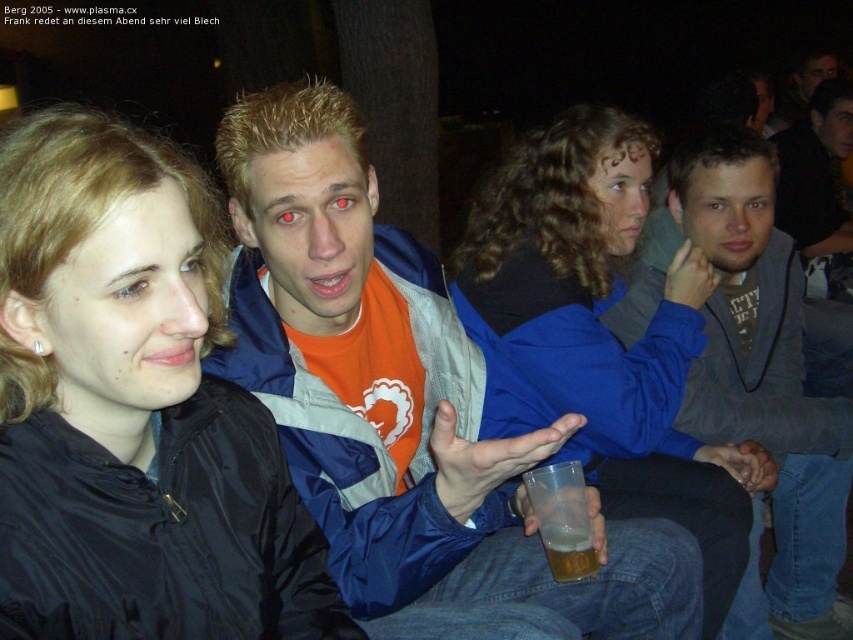
Question: Which object appears farthest from the camera in this image?

Choices:
 (A) translucent plastic cup at lower center
 (B) black matte jacket at center
 (C) gray fleece jacket at center

Answer: (C)

Question: Observing the image, what is the correct spatial positioning of orange fabric jacket at center in reference to translucent plastic cup at lower center?

Choices:
 (A) right
 (B) left

Answer: (B)

Question: Is the position of black matte jacket at center more distant than that of blue fabric jacket at center?

Choices:
 (A) no
 (B) yes

Answer: (A)

Question: In this image, where is black matte jacket at center located relative to gray fleece jacket at center?

Choices:
 (A) left
 (B) right

Answer: (A)

Question: Estimate the real-world distances between objects in this image. Which object is closer to the gray fleece jacket at center?

Choices:
 (A) black matte jacket at center
 (B) translucent plastic cup at lower center
 (C) blue fabric jacket at center
 (D) orange fabric jacket at center

Answer: (C)

Question: Estimate the real-world distances between objects in this image. Which object is farther from the orange fabric jacket at center?

Choices:
 (A) black matte jacket at center
 (B) gray fleece jacket at center

Answer: (B)